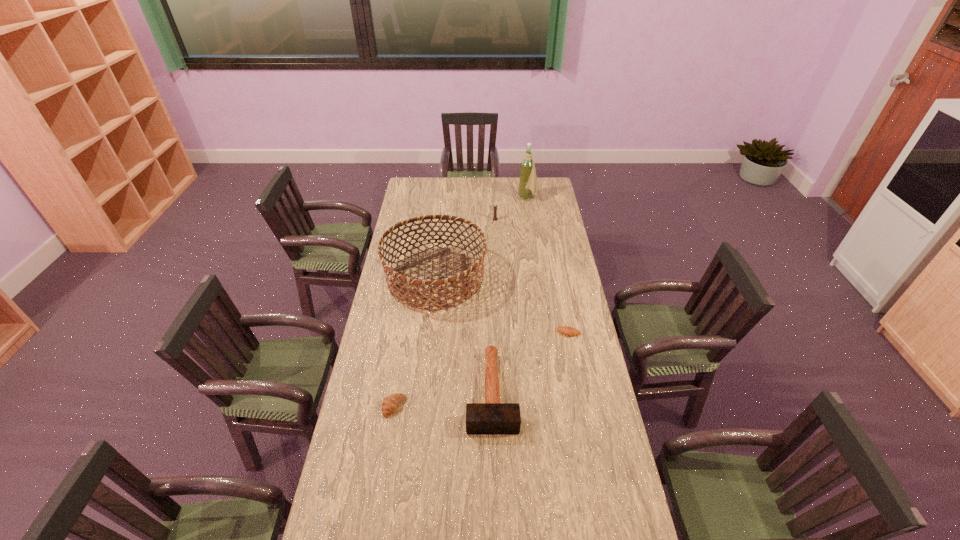
Where is `basket positioned at the left edge`? The height and width of the screenshot is (540, 960). basket positioned at the left edge is located at coordinates (401, 288).

Locate an element on the screen. This screenshot has height=540, width=960. crescent roll that is positioned at the left edge is located at coordinates (391, 403).

Locate an element on the screen. This screenshot has height=540, width=960. wine bottle located in the right edge section of the desktop is located at coordinates (528, 180).

This screenshot has width=960, height=540. What are the coordinates of `crescent roll present at the right edge` in the screenshot? It's located at (566, 330).

You are a GUI agent. You are given a task and a screenshot of the screen. Output one action in this format:
    pyautogui.click(x=<x>, y=<y>)
    Task: Click on the object present at the far right corner
    Image resolution: width=960 pixels, height=540 pixels.
    Given the screenshot: What is the action you would take?
    pyautogui.click(x=528, y=180)

In order to click on vacant space at the far edge of the desktop in this screenshot , I will do `click(496, 178)`.

At what (x,y) coordinates should I click in order to perform the action: click on free spot at the left edge of the desktop. Please return your answer as a coordinate pair (x, y). This screenshot has height=540, width=960. Looking at the image, I should click on (379, 296).

Identify the location of vacant region at the right edge. (559, 235).

Where is `free space between the third nearest object and the candle holder`? The width and height of the screenshot is (960, 540). free space between the third nearest object and the candle holder is located at coordinates (532, 276).

Locate an element on the screen. This screenshot has height=540, width=960. free space between the tallest object and the nearer crescent roll is located at coordinates (461, 302).